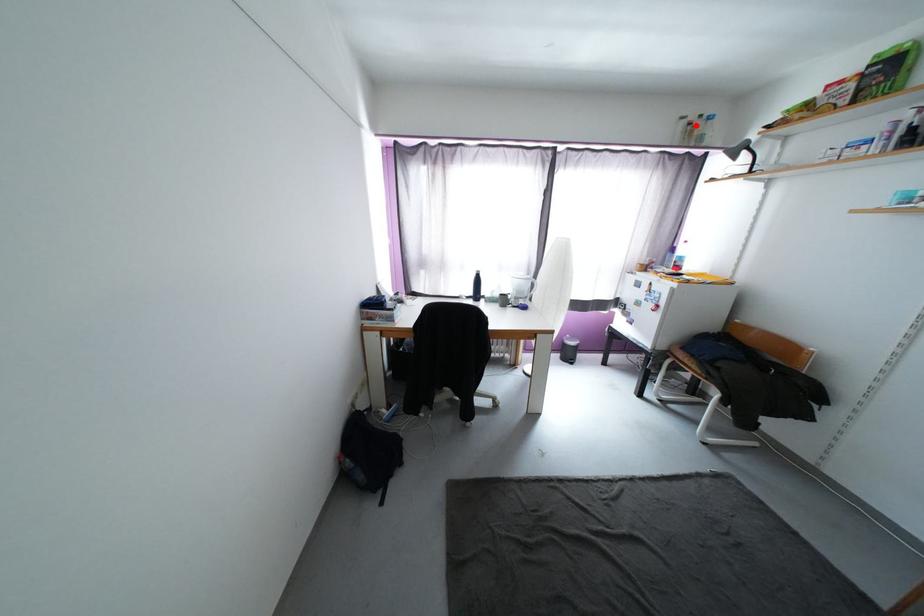
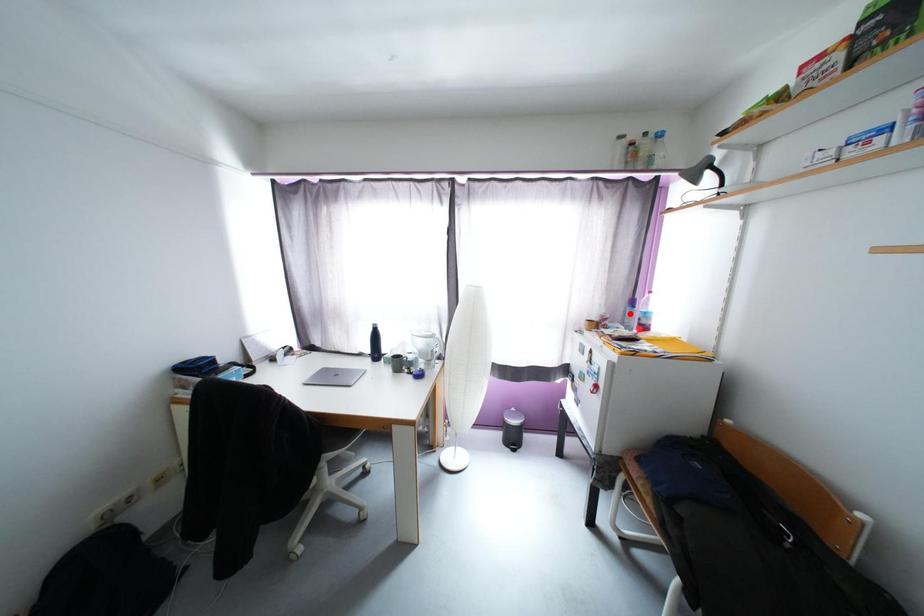
I am providing you with two images of the same scene from different viewpoints. A red point is marked on the first image and another point is marked on the second image. Does the point marked in image1 correspond to the same location as the one in image2?

No